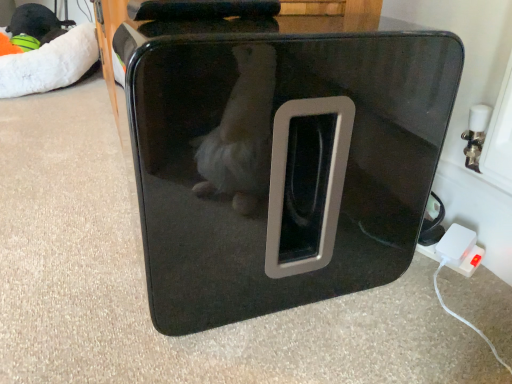
Question: Is white plush bean bag at upper left inside the boundaries of white plastic power adapter at lower right, or outside?

Choices:
 (A) inside
 (B) outside

Answer: (B)

Question: Considering the positions of white plush bean bag at upper left and white plastic power adapter at lower right in the image, is white plush bean bag at upper left wider or thinner than white plastic power adapter at lower right?

Choices:
 (A) wide
 (B) thin

Answer: (A)

Question: Which of these objects is positioned farthest from the glossy black pet carrier at center?

Choices:
 (A) white plush bean bag at upper left
 (B) white plastic power adapter at lower right

Answer: (A)

Question: Based on their relative distances, which object is nearer to the white plastic power adapter at lower right?

Choices:
 (A) white plush bean bag at upper left
 (B) glossy black pet carrier at center

Answer: (B)